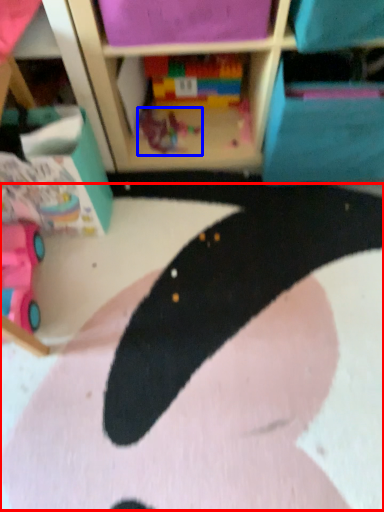
Question: Among these objects, which one is farthest to the camera, animal (highlighted by a red box) or toy (highlighted by a blue box)?

Choices:
 (A) animal
 (B) toy

Answer: (B)